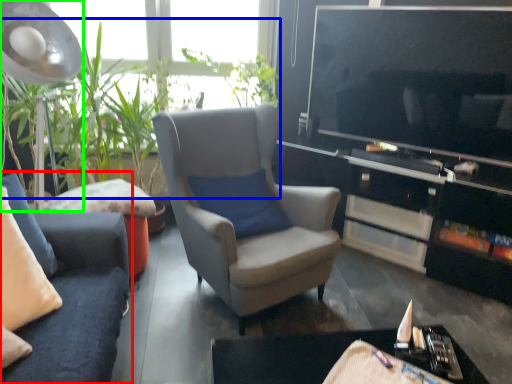
Question: Based on their relative distances, which object is farther from studio couch (highlighted by a red box)? Choose from vegetation (highlighted by a blue box) and lamp (highlighted by a green box).

Choices:
 (A) vegetation
 (B) lamp

Answer: (B)